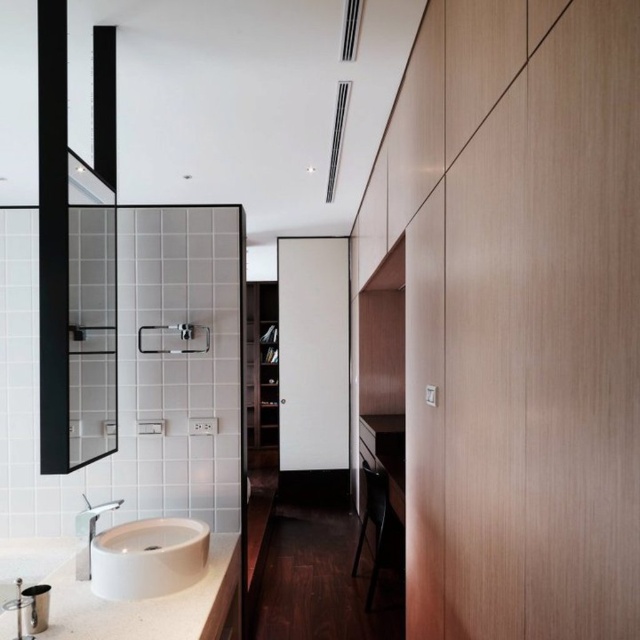
Question: Is white matte countertop at lower left to the left of white glossy sink at lower left from the viewer's perspective?

Choices:
 (A) yes
 (B) no

Answer: (A)

Question: Considering the real-world distances, which object is closest to the black glass mirror at upper left?

Choices:
 (A) matte silver faucet at lower left
 (B) white glossy sink at lower left
 (C) white matte countertop at lower left

Answer: (B)

Question: Is black glass mirror at upper left closer to camera compared to matte silver faucet at lower left?

Choices:
 (A) no
 (B) yes

Answer: (B)

Question: Which object appears closest to the camera in this image?

Choices:
 (A) white glossy sink at lower left
 (B) black glass mirror at upper left

Answer: (B)

Question: Based on their relative distances, which object is nearer to the white matte countertop at lower left?

Choices:
 (A) white glossy sink at lower left
 (B) black glass mirror at upper left
 (C) matte silver faucet at lower left

Answer: (A)

Question: Is black glass mirror at upper left thinner than white matte countertop at lower left?

Choices:
 (A) no
 (B) yes

Answer: (B)